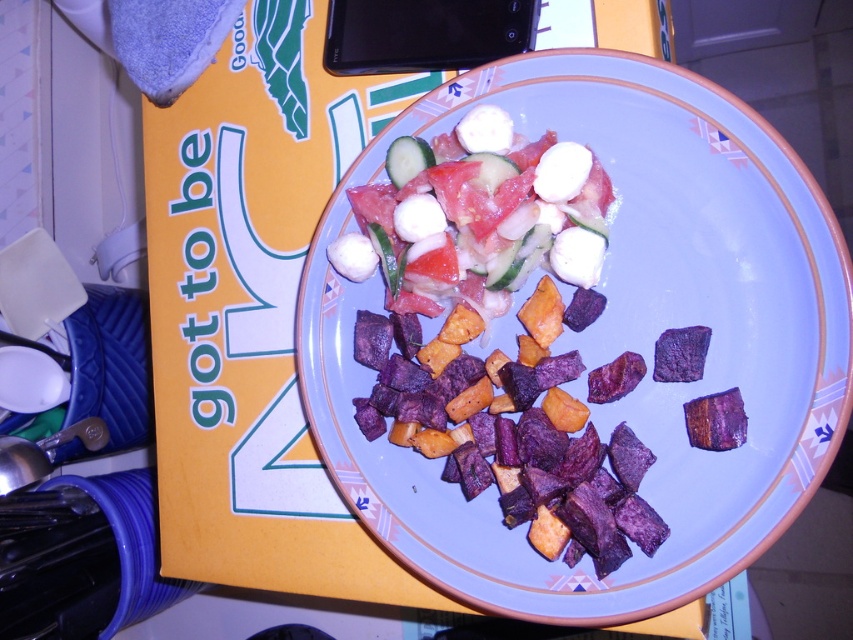
Can you confirm if purple matte sweet potato cubes at center is positioned below fresh tomato salad with mozzarella at center?

Indeed, purple matte sweet potato cubes at center is positioned under fresh tomato salad with mozzarella at center.

Does purple matte sweet potato cubes at center appear on the left side of fresh tomato salad with mozzarella at center?

Incorrect, purple matte sweet potato cubes at center is not on the left side of fresh tomato salad with mozzarella at center.

Is point (461, 592) in front of point (386, 259)?

Yes.

Locate an element on the screen. This screenshot has width=853, height=640. purple matte sweet potato cubes at center is located at coordinates (627, 330).